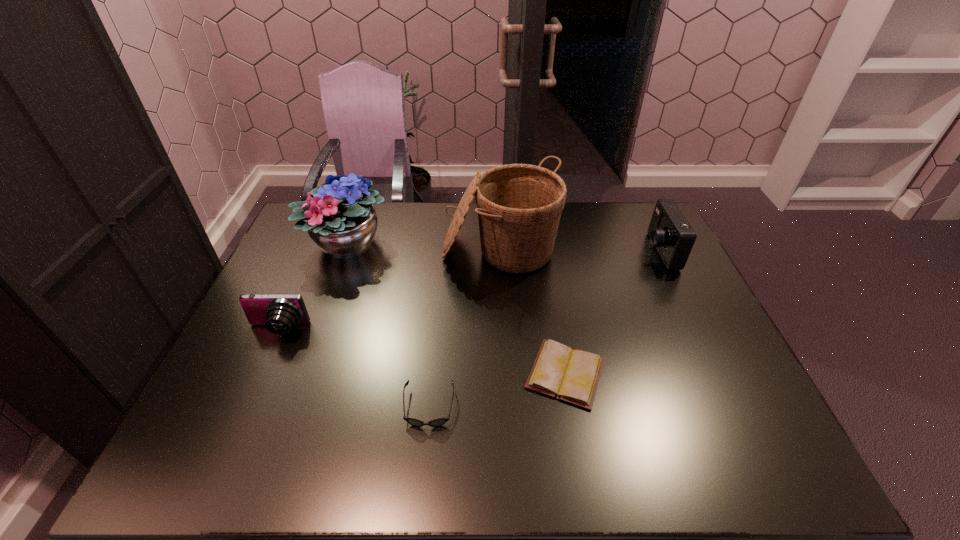
This screenshot has height=540, width=960. I want to click on vacant area situated on the front-facing side of the rightmost object, so click(x=608, y=251).

Identify the location of vacant area situated on the front-facing side of the rightmost object. This screenshot has height=540, width=960. (522, 251).

Image resolution: width=960 pixels, height=540 pixels. I want to click on vacant space located 0.150m on the front-facing side of the rightmost object, so 599,251.

Identify the location of free location located 0.100m on the front-facing side of the third shortest object. (258, 374).

What are the coordinates of `vacant position located 0.090m on the lenses of the sunglasses` in the screenshot? It's located at [423, 470].

I want to click on vacant region located 0.130m on the back of the shortest object, so click(x=554, y=305).

The height and width of the screenshot is (540, 960). Identify the location of basket present at the far edge. (519, 206).

You are a GUI agent. You are given a task and a screenshot of the screen. Output one action in this format:
    pyautogui.click(x=<x>, y=<y>)
    Task: Click on the bouquet at the far edge
    The height and width of the screenshot is (540, 960).
    Given the screenshot: What is the action you would take?
    pyautogui.click(x=339, y=221)

Image resolution: width=960 pixels, height=540 pixels. I want to click on camera positioned at the far edge, so click(669, 231).

The width and height of the screenshot is (960, 540). I want to click on bouquet located in the left edge section of the desktop, so click(x=339, y=221).